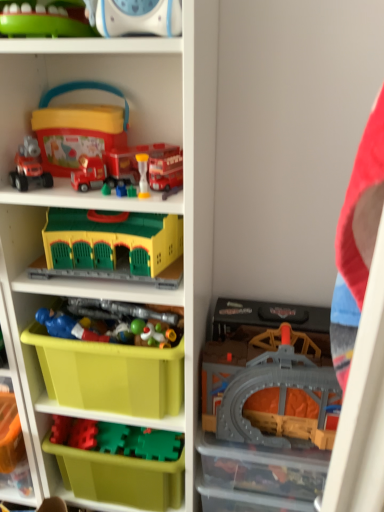
Question: From a real-world perspective, is translucent plastic toy at center, the 2th toy when ordered from bottom to top, on top of green plastic bin at lower left?

Choices:
 (A) no
 (B) yes

Answer: (B)

Question: Is translucent plastic toy at center, the 2th toy when ordered from bottom to top, behind green plastic bin at lower left?

Choices:
 (A) no
 (B) yes

Answer: (A)

Question: From the image's perspective, is translucent plastic toy at center, the sixth toy in the top-to-bottom sequence, above green plastic bin at lower left?

Choices:
 (A) yes
 (B) no

Answer: (A)

Question: Considering the relative positions of translucent plastic toy at center, the 2th toy when ordered from bottom to top, and green plastic bin at lower left in the image provided, is translucent plastic toy at center, the 2th toy when ordered from bottom to top, to the left of green plastic bin at lower left from the viewer's perspective?

Choices:
 (A) yes
 (B) no

Answer: (B)

Question: Is translucent plastic toy at center, the sixth toy in the top-to-bottom sequence, turned away from green plastic bin at lower left?

Choices:
 (A) yes
 (B) no

Answer: (B)

Question: Does translucent plastic toy at center, the sixth toy in the top-to-bottom sequence, appear on the right side of green plastic bin at lower left?

Choices:
 (A) yes
 (B) no

Answer: (A)

Question: Can you confirm if matte red truck at upper left, arranged as the 1th toy when viewed from the top, is positioned to the left of translucent plastic toy at center, the 2th toy when ordered from bottom to top?

Choices:
 (A) yes
 (B) no

Answer: (A)

Question: Considering the relative sizes of matte red truck at upper left, arranged as the 1th toy when viewed from the top, and translucent plastic toy at center, the 2th toy when ordered from bottom to top, in the image provided, is matte red truck at upper left, arranged as the 1th toy when viewed from the top, shorter than translucent plastic toy at center, the 2th toy when ordered from bottom to top,?

Choices:
 (A) yes
 (B) no

Answer: (B)

Question: Does matte red truck at upper left, arranged as the 1th toy when viewed from the top, have a greater height compared to translucent plastic toy at center, the sixth toy in the top-to-bottom sequence?

Choices:
 (A) no
 (B) yes

Answer: (B)

Question: Is matte red truck at upper left, arranged as the 1th toy when viewed from the top, located outside translucent plastic toy at center, the sixth toy in the top-to-bottom sequence?

Choices:
 (A) no
 (B) yes

Answer: (B)

Question: Is matte red truck at upper left, arranged as the 1th toy when viewed from the top, oriented towards translucent plastic toy at center, the 2th toy when ordered from bottom to top?

Choices:
 (A) yes
 (B) no

Answer: (B)

Question: Is translucent plastic toy at center, the 2th toy when ordered from bottom to top, at the back of matte red truck at upper left, arranged as the 1th toy when viewed from the top?

Choices:
 (A) no
 (B) yes

Answer: (A)

Question: Can you confirm if translucent plastic toy at center, acting as the 4th toy starting from the bottom, is positioned to the left of blue plastic figure at center, the fifth toy from the top?

Choices:
 (A) no
 (B) yes

Answer: (A)